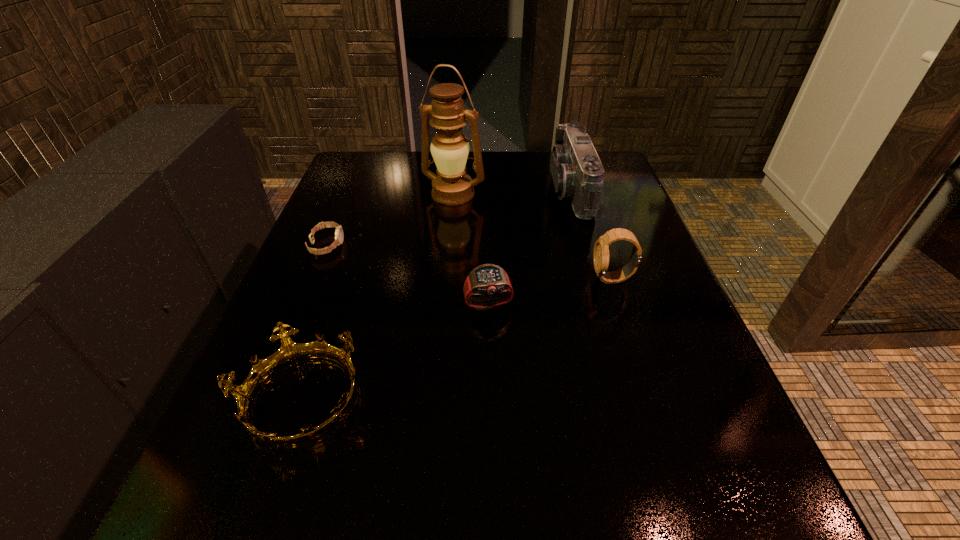
The image size is (960, 540). I want to click on camcorder positioned at the far edge, so click(578, 175).

What are the coordinates of `crown situated at the left edge` in the screenshot? It's located at (289, 352).

This screenshot has width=960, height=540. In order to click on watch that is at the left edge in this screenshot , I will do `click(339, 236)`.

Locate an element on the screen. This screenshot has width=960, height=540. camcorder at the right edge is located at coordinates (578, 175).

You are a GUI agent. You are given a task and a screenshot of the screen. Output one action in this format:
    pyautogui.click(x=<x>, y=<y>)
    Task: Click on the watch that is at the right edge
    
    Given the screenshot: What is the action you would take?
    pyautogui.click(x=601, y=249)

Find the location of a particular element. object that is at the far right corner is located at coordinates (578, 175).

Find the location of a particular element. The height and width of the screenshot is (540, 960). free space at the far edge of the desktop is located at coordinates (431, 171).

At what (x,y) coordinates should I click in order to perform the action: click on vacant space at the near edge of the desktop. Please return your answer as a coordinate pair (x, y). The width and height of the screenshot is (960, 540). Looking at the image, I should click on (552, 505).

In the image, there is a desktop. Where is `vacant space at the left edge`? vacant space at the left edge is located at coordinates (307, 294).

The image size is (960, 540). Find the location of `free space at the right edge of the desktop`. free space at the right edge of the desktop is located at coordinates (685, 364).